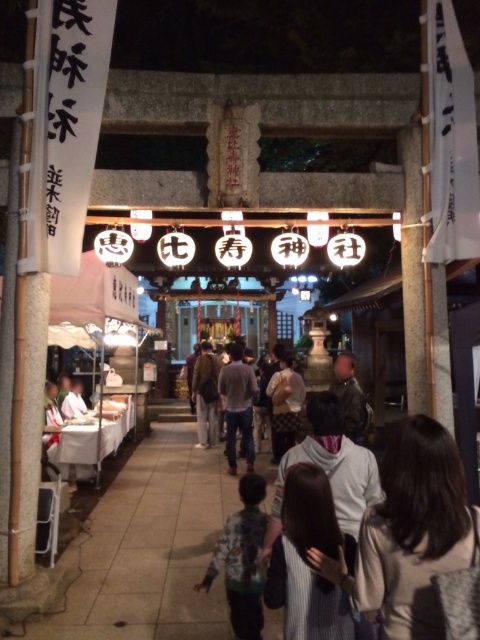
Can you confirm if camouflage jacket at center is shorter than dark gray sweater at center?

Yes.

I want to click on camouflage jacket at center, so click(x=241, y=560).

Can you confirm if camouflage jacket at center is positioned to the right of brown leather jacket at center?

Yes, camouflage jacket at center is to the right of brown leather jacket at center.

Does camouflage jacket at center have a lesser height compared to brown leather jacket at center?

Correct, camouflage jacket at center is not as tall as brown leather jacket at center.

At what (x,y) coordinates should I click in order to perform the action: click on camouflage jacket at center. Please return your answer as a coordinate pair (x, y). The height and width of the screenshot is (640, 480). Looking at the image, I should click on (241, 560).

Between camouflage jacket at center and plaid fabric shirt at center, which one is positioned lower?

camouflage jacket at center is below.

Is camouflage jacket at center to the right of plaid fabric shirt at center from the viewer's perspective?

In fact, camouflage jacket at center is to the left of plaid fabric shirt at center.

Where is `camouflage jacket at center`? camouflage jacket at center is located at coordinates (241, 560).